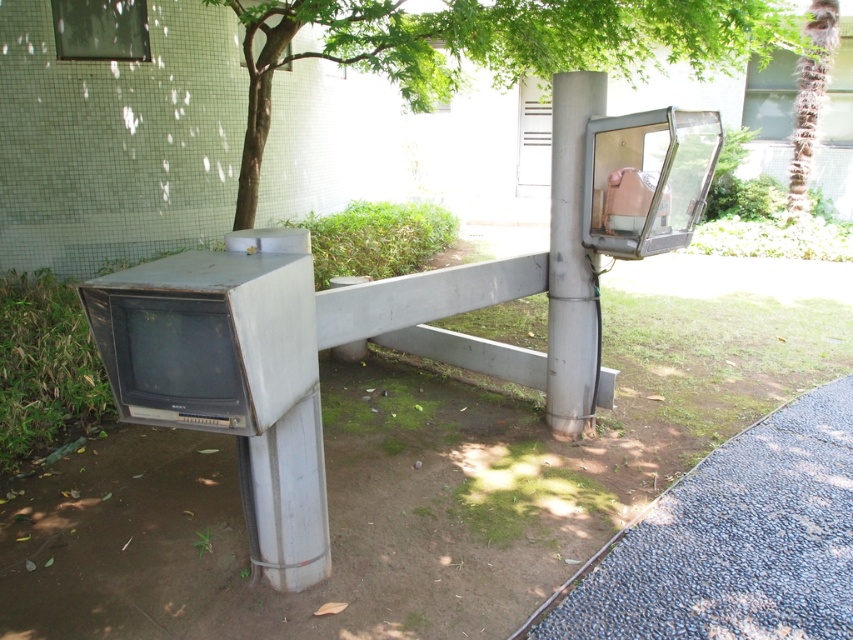
Question: Is green leafy tree at upper center further to camera compared to green textured palm tree at upper right?

Choices:
 (A) yes
 (B) no

Answer: (B)

Question: Which object is the farthest from the green leafy tree at upper center?

Choices:
 (A) silver metallic pillar at lower left
 (B) green textured palm tree at upper right
 (C) metallic gray pole at upper center

Answer: (B)

Question: Can you confirm if gray gravel at lower right is positioned to the right of silver metallic pillar at lower left?

Choices:
 (A) yes
 (B) no

Answer: (A)

Question: Is silver metallic pillar at lower left further to camera compared to green textured palm tree at upper right?

Choices:
 (A) no
 (B) yes

Answer: (A)

Question: Which point is farther to the camera?

Choices:
 (A) (270, 228)
 (B) (706, 605)
 (C) (569, 120)
 (D) (309, 1)

Answer: (D)

Question: Among these objects, which one is nearest to the camera?

Choices:
 (A) gray gravel at lower right
 (B) silver metallic pillar at lower left
 (C) green textured palm tree at upper right
 (D) green leafy tree at upper center

Answer: (B)